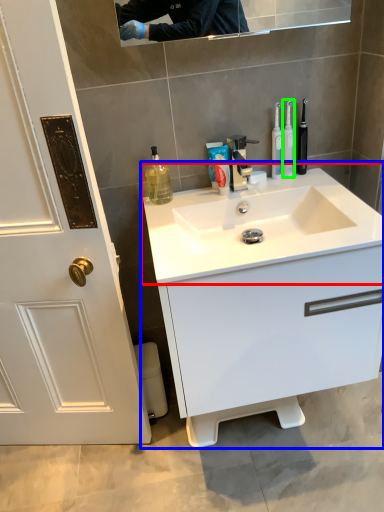
Question: Which object is positioned closest to sink (highlighted by a red box)? Select from bathroom cabinet (highlighted by a blue box) and toothbrush (highlighted by a green box).

Choices:
 (A) bathroom cabinet
 (B) toothbrush

Answer: (A)